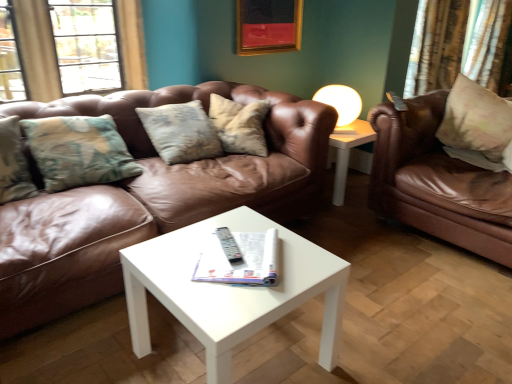
This screenshot has height=384, width=512. Identify the location of vacant space underneath white paper magazine at center (from a real-world perspective). (226, 262).